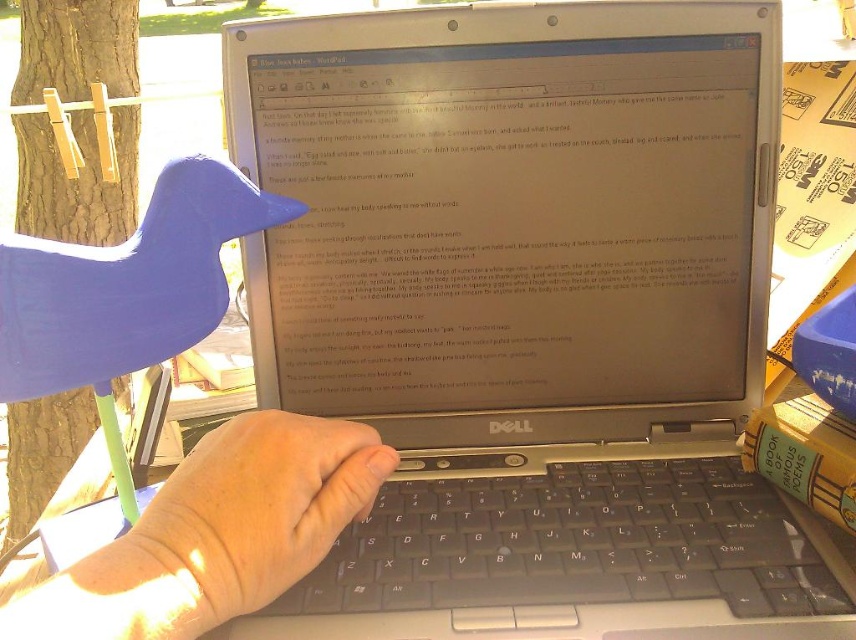
Question: Which point is closer to the camera?

Choices:
 (A) skinny white hand at center
 (B) black plastic keyboard at center
 (C) silver metallic laptop at center

Answer: (A)

Question: Which is farther from the skinny white hand at center?

Choices:
 (A) black plastic keyboard at center
 (B) silver metallic laptop at center

Answer: (B)

Question: Can you confirm if silver metallic laptop at center is positioned above skinny white hand at center?

Choices:
 (A) yes
 (B) no

Answer: (A)

Question: Which object is the closest to the black plastic keyboard at center?

Choices:
 (A) silver metallic laptop at center
 (B) skinny white hand at center

Answer: (B)

Question: Does silver metallic laptop at center appear on the right side of skinny white hand at center?

Choices:
 (A) no
 (B) yes

Answer: (B)

Question: Does silver metallic laptop at center appear over black plastic keyboard at center?

Choices:
 (A) no
 (B) yes

Answer: (B)